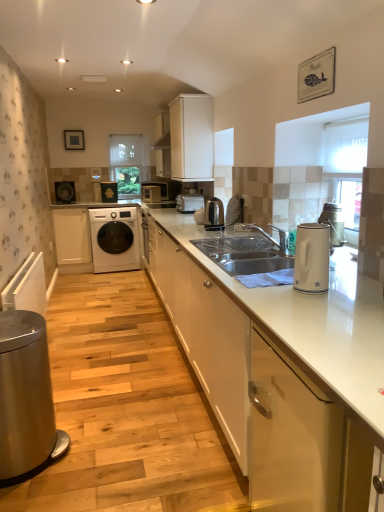
The width and height of the screenshot is (384, 512). In order to click on empty space that is ontop of matte black washing machine at left, placed as the first appliance when sorted from left to right (from a real-world perspective) in this screenshot , I will do `click(62, 181)`.